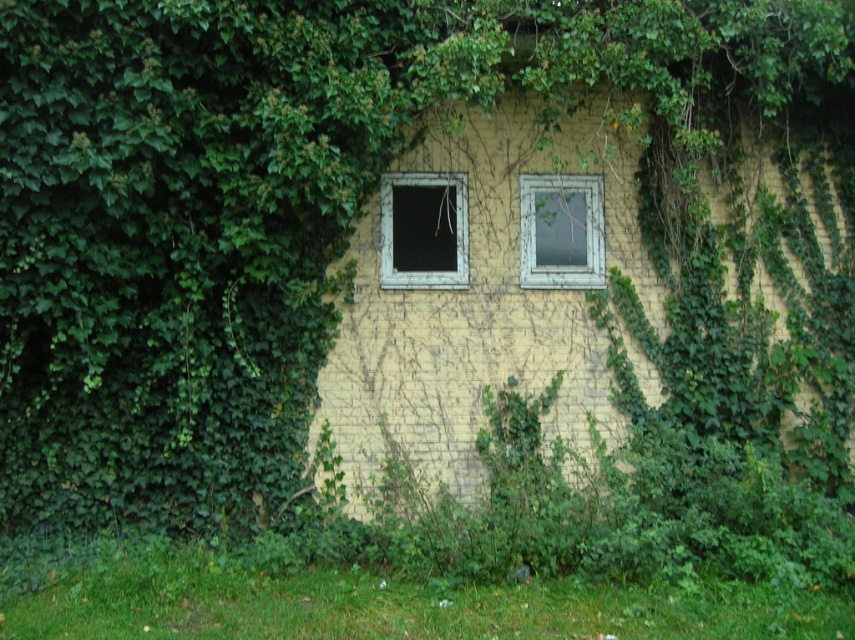
You are standing in front of a building with ivy covering its walls. You see two windows at the center of the wall. Which window is closer to you, the matte gray window at center or the white wooden window at center?

The matte gray window at center is closer to the viewer than the white wooden window at center.

You are an architect examining the building facade. You notice two windows at the center. Which window is shorter in height between the matte gray window at center and the white wooden window at center?

The matte gray window at center is shorter in height compared to the white wooden window at center.